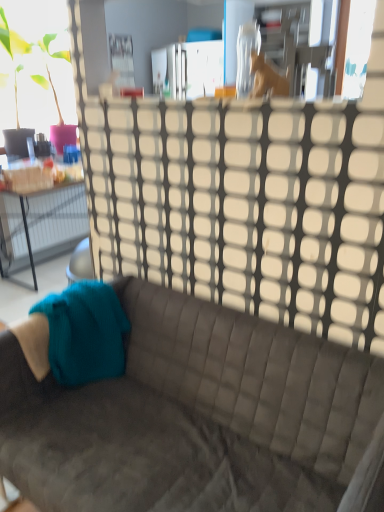
Question: Looking at their shapes, would you say teal knitted fabric at lower left is wider or thinner than transparent plastic glass door at upper center?

Choices:
 (A) thin
 (B) wide

Answer: (B)

Question: From the image's perspective, is teal knitted fabric at lower left located above or below transparent plastic glass door at upper center?

Choices:
 (A) above
 (B) below

Answer: (B)

Question: Considering the real-world distances, which object is closest to the wooden horse at upper center?

Choices:
 (A) teal knitted fabric at lower left
 (B) transparent plastic glass door at upper center
 (C) suede gray couch at center

Answer: (B)

Question: Based on their relative distances, which object is nearer to the suede gray couch at center?

Choices:
 (A) wooden horse at upper center
 (B) transparent plastic glass door at upper center
 (C) teal knitted fabric at lower left

Answer: (C)